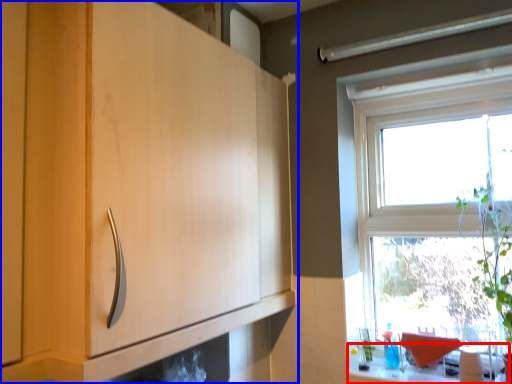
Question: Which object is further to the camera taking this photo, counter top (highlighted by a red box) or cabinetry (highlighted by a blue box)?

Choices:
 (A) counter top
 (B) cabinetry

Answer: (A)